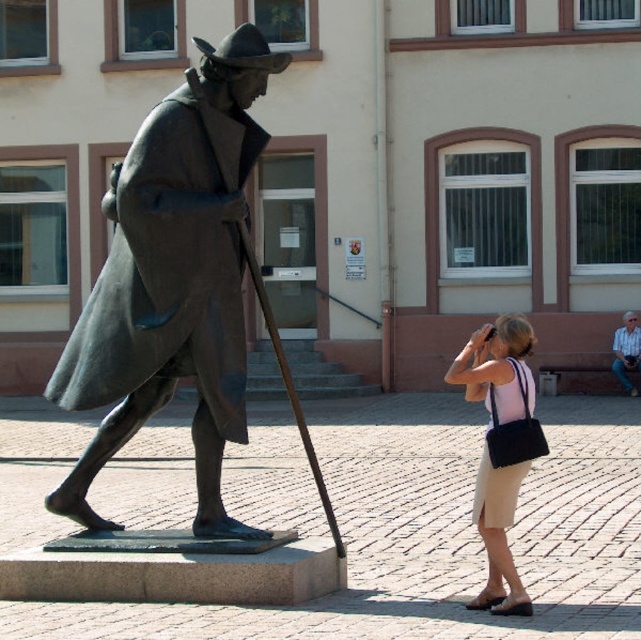
What do you see at coordinates (178, 285) in the screenshot? Image resolution: width=641 pixels, height=640 pixels. I see `bronze statue at left` at bounding box center [178, 285].

You are a GUI agent. You are given a task and a screenshot of the screen. Output one action in this format:
    pyautogui.click(x=<x>, y=<y>)
    Task: Click on the bronze statue at left
    This screenshot has width=641, height=640.
    Given the screenshot: What is the action you would take?
    pyautogui.click(x=178, y=285)

Can you confirm if bronze statue at left is positioned below beige fabric skirt at lower right?

Incorrect, bronze statue at left is not positioned below beige fabric skirt at lower right.

Between bronze statue at left and beige fabric skirt at lower right, which one is positioned lower?

beige fabric skirt at lower right is below.

Between point (222, 420) and point (528, 467), which one is positioned in front?

Point (528, 467) is more forward.

Find the location of a particular element. bronze statue at left is located at coordinates (178, 285).

Is beige fabric skirt at lower right below light blue shirt at right?

Actually, beige fabric skirt at lower right is above light blue shirt at right.

From the picture: Which is more to the right, beige fabric skirt at lower right or light blue shirt at right?

From the viewer's perspective, light blue shirt at right appears more on the right side.

Image resolution: width=641 pixels, height=640 pixels. In order to click on beige fabric skirt at lower right in this screenshot , I will do `click(501, 448)`.

Find the location of a particular element. beige fabric skirt at lower right is located at coordinates (501, 448).